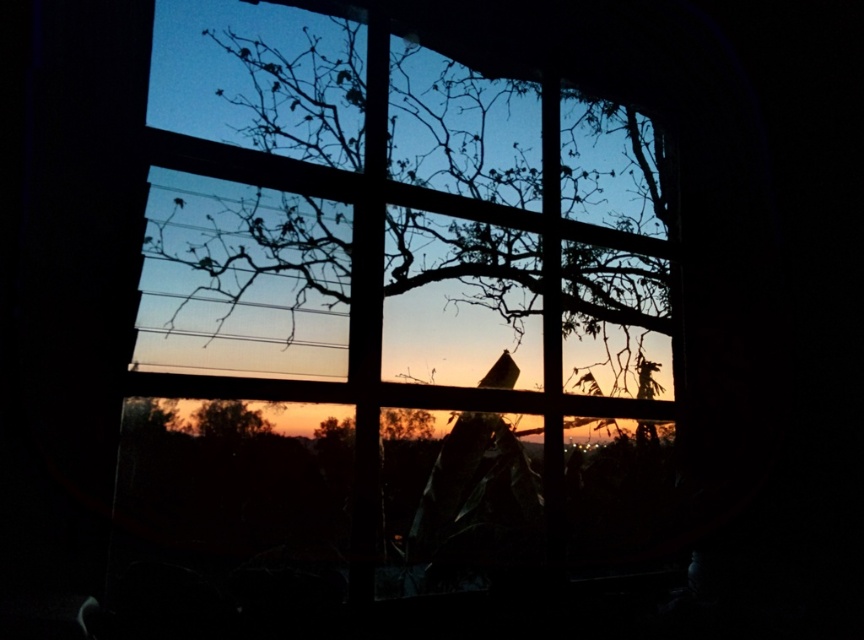
Question: Which point is farther to the camera?

Choices:
 (A) brown matte tree at lower center
 (B) silhouette wood tree at center

Answer: (A)

Question: Considering the relative positions of silhouette wood tree at center and brown matte tree at lower center in the image provided, where is silhouette wood tree at center located with respect to brown matte tree at lower center?

Choices:
 (A) above
 (B) below

Answer: (A)

Question: Can you confirm if silhouette wood tree at center is thinner than brown matte tree at lower center?

Choices:
 (A) yes
 (B) no

Answer: (B)

Question: Where is silhouette wood tree at center located in relation to brown matte tree at lower center in the image?

Choices:
 (A) above
 (B) below

Answer: (A)

Question: Which of the following is the farthest from the observer?

Choices:
 (A) silhouette wood tree at center
 (B) brown matte tree at lower center

Answer: (B)